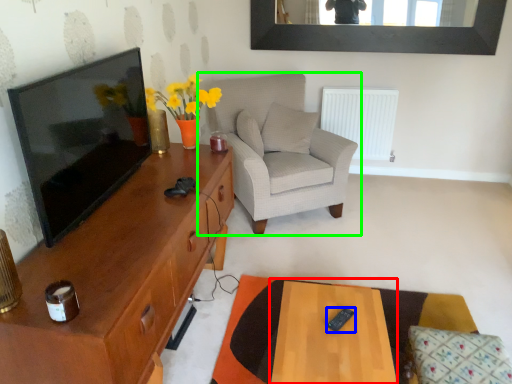
Question: Which object is positioned farthest from table (highlighted by a red box)? Select from remote control (highlighted by a blue box) and chair (highlighted by a green box).

Choices:
 (A) remote control
 (B) chair

Answer: (B)